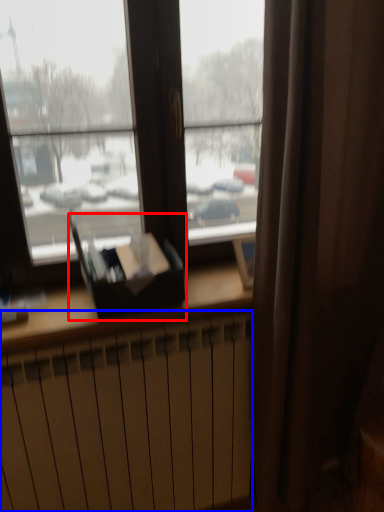
Question: Which of the following is the farthest to the observer, paperback book (highlighted by a red box) or radiator (highlighted by a blue box)?

Choices:
 (A) paperback book
 (B) radiator

Answer: (A)